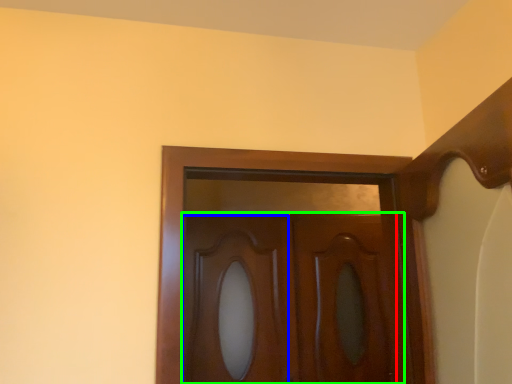
Question: Considering the real-world distances, which object is farthest from screen door (highlighted by a red box)? cabinetry (highlighted by a blue box) or door (highlighted by a green box)?

Choices:
 (A) cabinetry
 (B) door

Answer: (A)